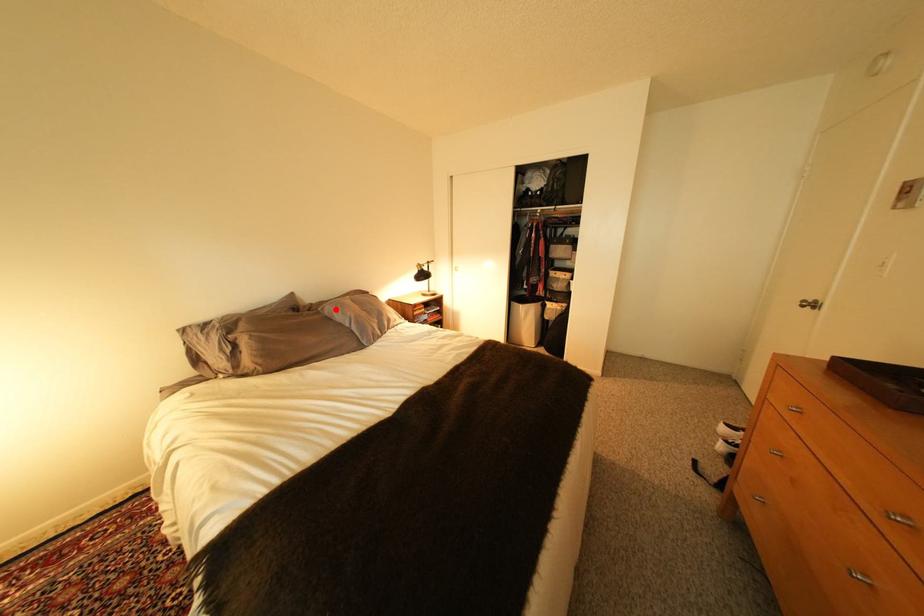
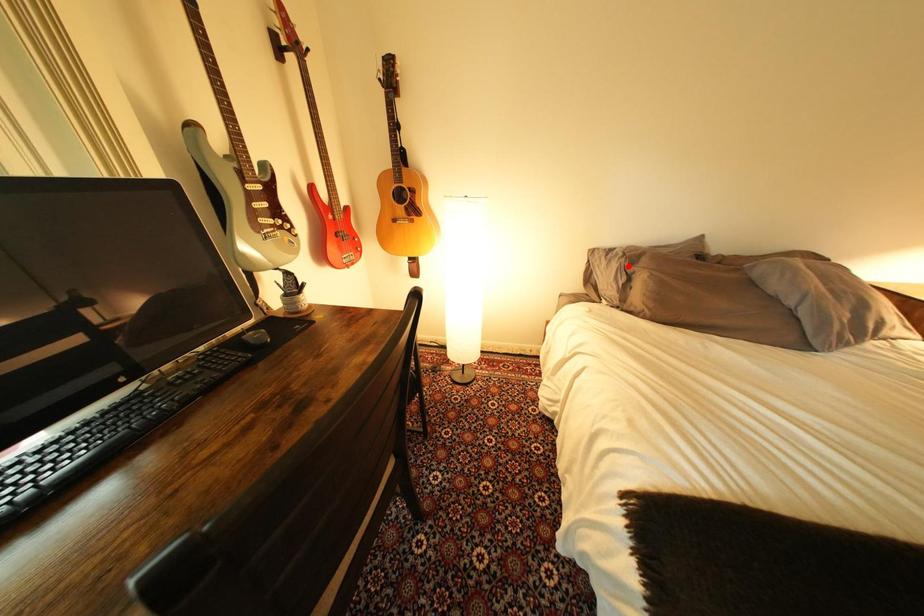
I am providing you with two images of the same scene from different viewpoints. A red point is marked on the first image and another point is marked on the second image. Does the point marked in image1 correspond to the same location as the one in image2?

No